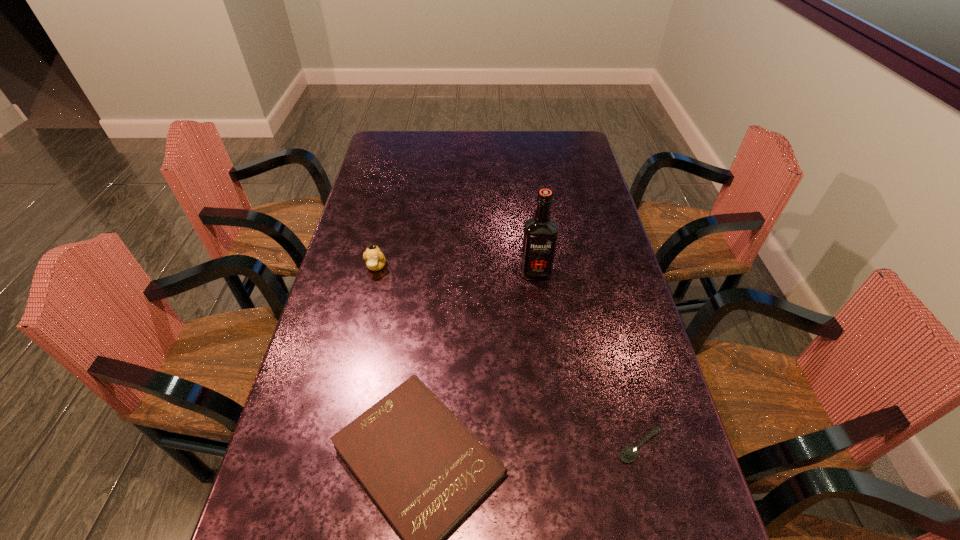
This screenshot has height=540, width=960. Find the location of `liquor`. liquor is located at coordinates tap(540, 235).

Locate an element on the screen. the second object from right to left is located at coordinates (540, 235).

Where is `duckling`? The image size is (960, 540). duckling is located at coordinates (375, 260).

This screenshot has height=540, width=960. What are the coordinates of `soupspoon` in the screenshot? It's located at (628, 454).

I want to click on the rightmost object, so click(x=628, y=454).

Find the location of a particular element. The height and width of the screenshot is (540, 960). free region located 0.330m on the front-facing side of the tallest object is located at coordinates (549, 378).

Identify the location of vacant area situated 0.160m on the face of the duckling. (364, 319).

Identify the location of vacant area situated 0.150m on the left of the soupspoon. This screenshot has height=540, width=960. click(548, 446).

The width and height of the screenshot is (960, 540). I want to click on object that is at the left edge, so click(x=375, y=260).

Identify the location of object that is at the right edge. (628, 454).